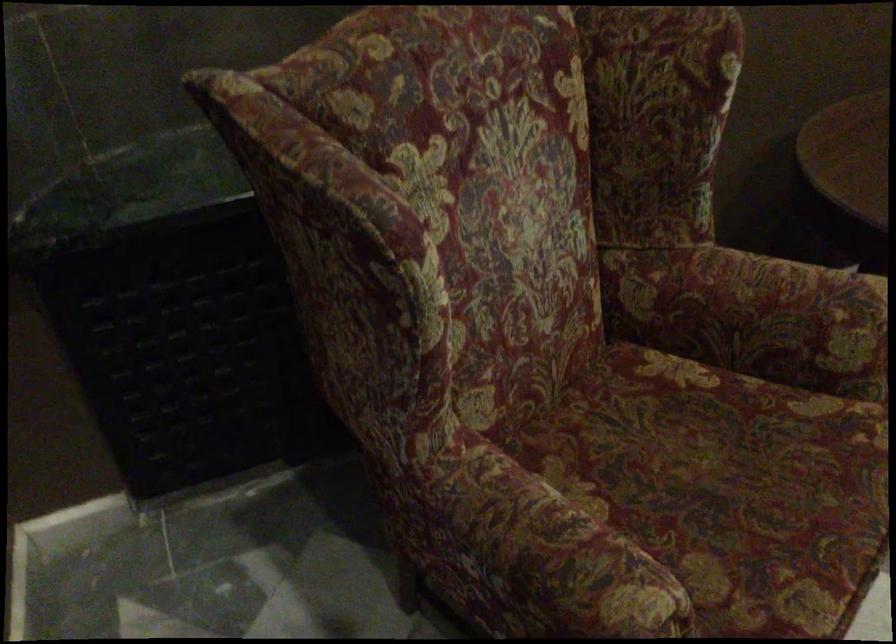
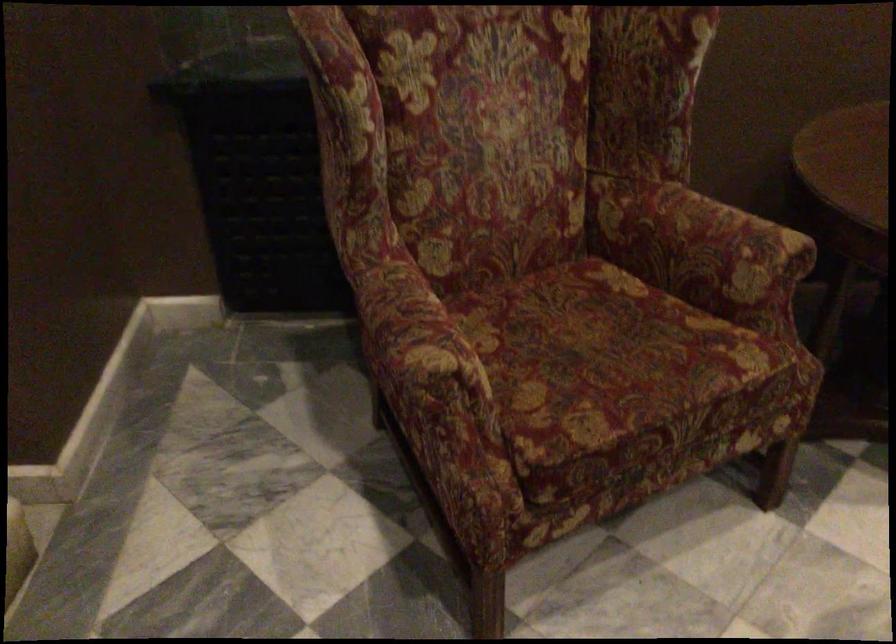
Which direction would the cameraman need to move to produce the second image?

The cameraman walked toward right, backward.